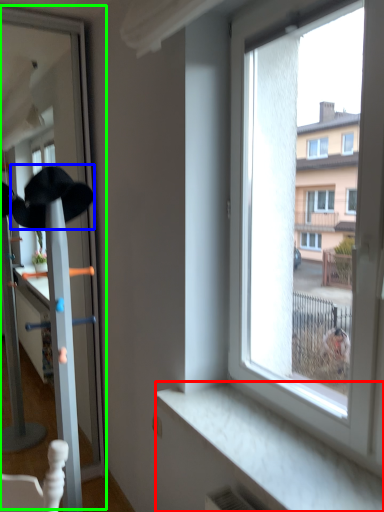
Question: Considering the real-world distances, which object is farthest from window sill (highlighted by a red box)? baseball hat (highlighted by a blue box) or screen door (highlighted by a green box)?

Choices:
 (A) baseball hat
 (B) screen door

Answer: (B)